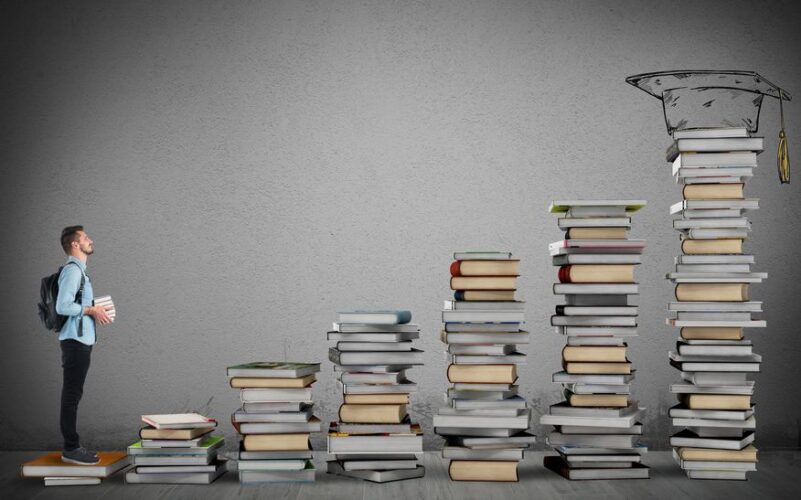
Locate an element on the screen. The height and width of the screenshot is (500, 801). stacks of books is located at coordinates (74, 472), (168, 457), (272, 425), (368, 398), (469, 365), (588, 345), (702, 312).